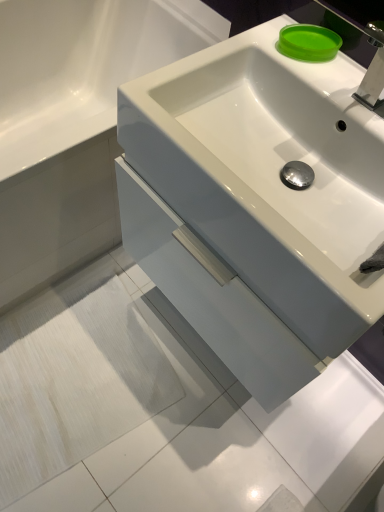
Question: Is green matte soap at upper right wider or thinner than white glossy sink at center?

Choices:
 (A) thin
 (B) wide

Answer: (A)

Question: From a real-world perspective, is green matte soap at upper right above or below white glossy sink at center?

Choices:
 (A) below
 (B) above

Answer: (B)

Question: Based on their relative distances, which object is nearer to the white glossy cabinet at center?

Choices:
 (A) white glossy sink at center
 (B) green matte soap at upper right

Answer: (A)

Question: Which is nearer to the green matte soap at upper right?

Choices:
 (A) white glossy sink at center
 (B) white glossy cabinet at center

Answer: (A)